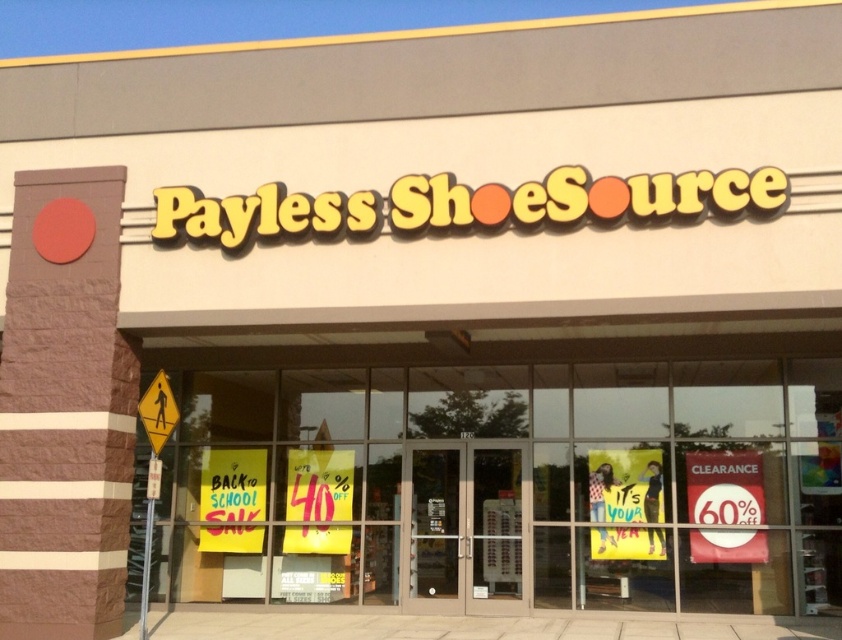
Consider the image. You are standing in front of the Payless ShoeSource store. You notice two points marked on the facade. The first point is at coordinate point (835,605) and the second is at point (690,496). Which point is closer to you?

Point (835,605) is closer to the viewer than point (690,496).

You are a customer standing in front of the Payless ShoeSource store. You see the red paper sign at lower right and the yellow reflective pedestrian crossing sign at lower left. Which sign is taller?

The red paper sign at lower right is taller than the yellow reflective pedestrian crossing sign at lower left.

You are a customer standing in front of the Payless ShoeSource store. You want to see the promotional signs displayed on the yellow glass window at center and the red paper sign at lower right. Which one is located higher?

The yellow glass window at center is positioned over the red paper sign at lower right, so the yellow glass window at center is higher.